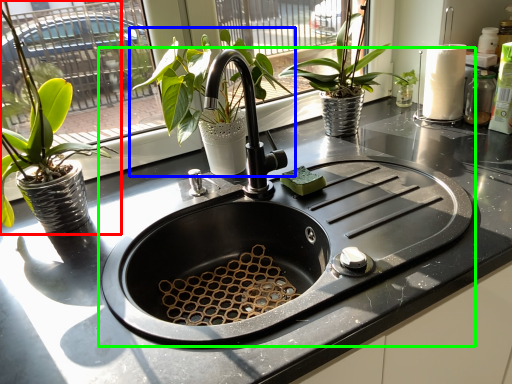
Question: Estimate the real-world distances between objects in this image. Which object is closer to houseplant (highlighted by a red box), houseplant (highlighted by a blue box) or sink (highlighted by a green box)?

Choices:
 (A) houseplant
 (B) sink

Answer: (A)